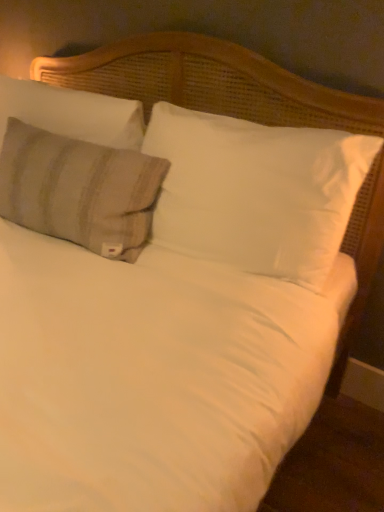
Question: Considering the positions of point pos(11,117) and point pos(43,113), is point pos(11,117) closer or farther from the camera than point pos(43,113)?

Choices:
 (A) farther
 (B) closer

Answer: (A)

Question: Do you think beige striped fabric pillow at upper left, which is counted as the 2th pillow, starting from the right, is within beige striped pillow at left, which is the 3th pillow in right-to-left order, or outside of it?

Choices:
 (A) outside
 (B) inside

Answer: (A)

Question: Which of these objects is positioned farthest from the white soft pillow at center, which is the first pillow in right-to-left order?

Choices:
 (A) beige striped pillow at left, which ranks as the 1th pillow in left-to-right order
 (B) beige striped fabric pillow at upper left, acting as the 2th pillow starting from the left

Answer: (A)

Question: Which object is positioned closest to the beige striped pillow at left, which ranks as the 1th pillow in left-to-right order?

Choices:
 (A) white soft pillow at center, which is the first pillow in right-to-left order
 (B) beige striped fabric pillow at upper left, which is counted as the 2th pillow, starting from the right

Answer: (B)